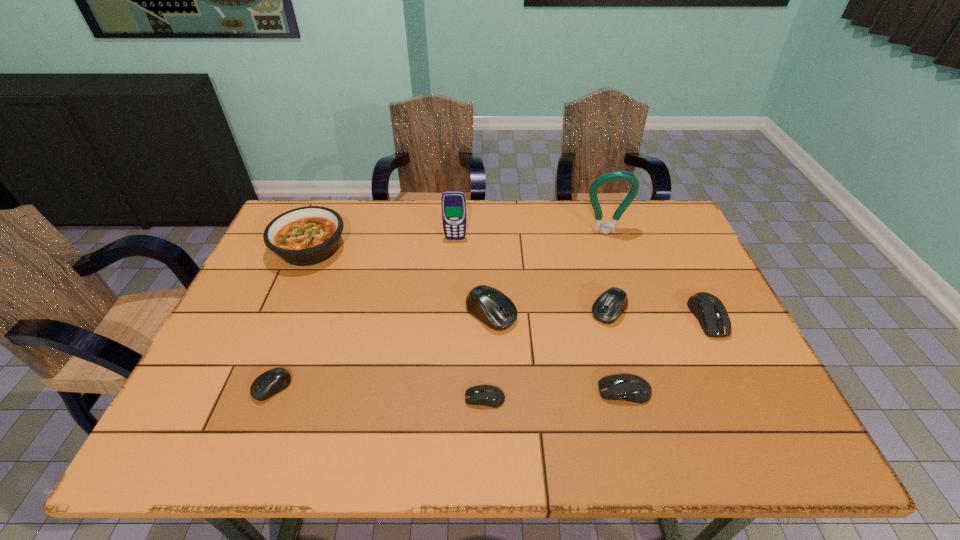
Locate an element on the screen. vacant space positioned 0.080m on the button of the farthest dark computer equipment is located at coordinates (732, 367).

Identify the location of vacant area situated on the button of the second biggest dark computer equipment. (519, 391).

At what (x,y) coordinates should I click in order to perform the action: click on vacant space located 0.190m on the button of the second biggest dark computer equipment. Please return your answer as a coordinate pair (x, y). The image size is (960, 540). Looking at the image, I should click on (515, 391).

Identify the location of free location located 0.380m on the button of the second biggest dark computer equipment. Image resolution: width=960 pixels, height=540 pixels. pos(431,391).

Where is `free point located on the right of the leftmost computer equipment`? This screenshot has height=540, width=960. free point located on the right of the leftmost computer equipment is located at coordinates (312, 387).

I want to click on vacant space located on the button of the shortest object, so click(x=425, y=398).

Identify the location of vacant space located on the button of the shortest object. (345, 398).

Locate an element on the screen. Image resolution: width=960 pixels, height=540 pixels. free space located on the button of the shortest object is located at coordinates (416, 398).

Locate an element on the screen. The image size is (960, 540). bottle opener that is at the far edge is located at coordinates (599, 226).

Where is `cellular telephone located at the far edge`? The height and width of the screenshot is (540, 960). cellular telephone located at the far edge is located at coordinates (453, 203).